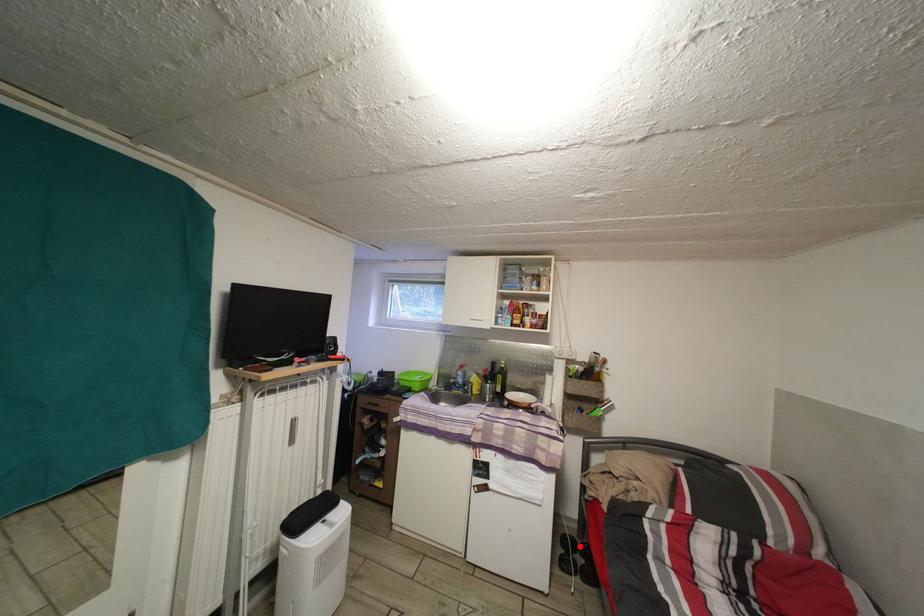
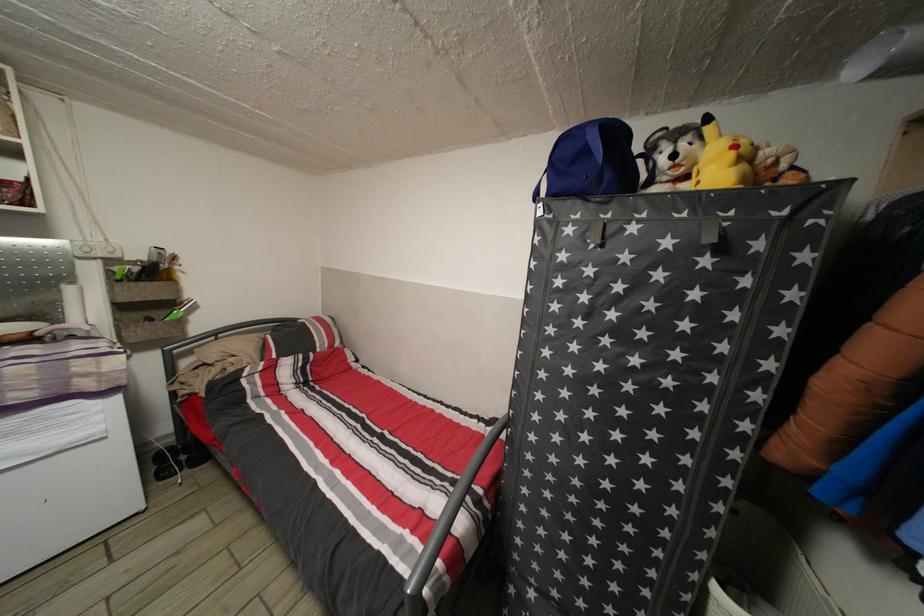
Find the pixel in the second image that matches the highlighted location in the first image.

(177, 455)